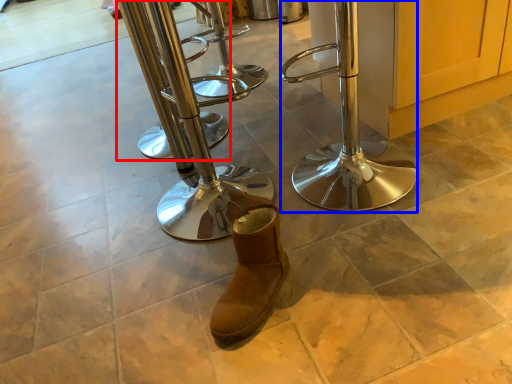
Question: Which of the following is the farthest to the observer, step stool (highlighted by a red box) or step stool (highlighted by a blue box)?

Choices:
 (A) step stool
 (B) step stool

Answer: (A)